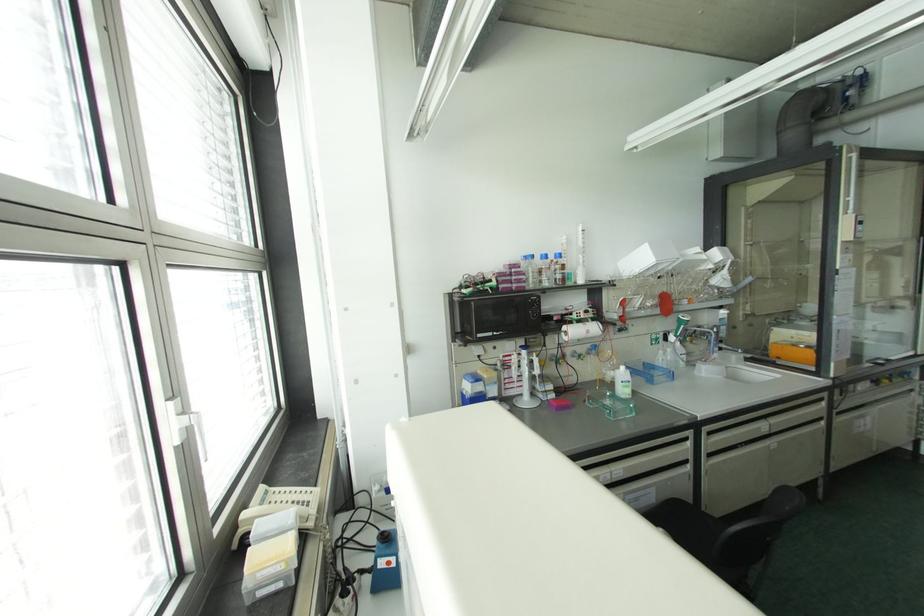
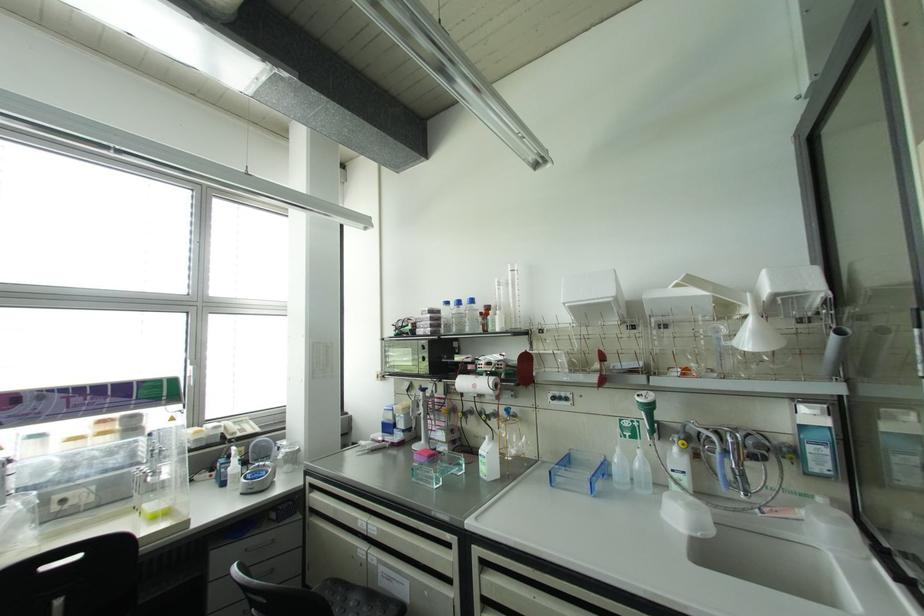
Where in the second image is the point corresponding to point (531, 256) from the first image?

(446, 302)